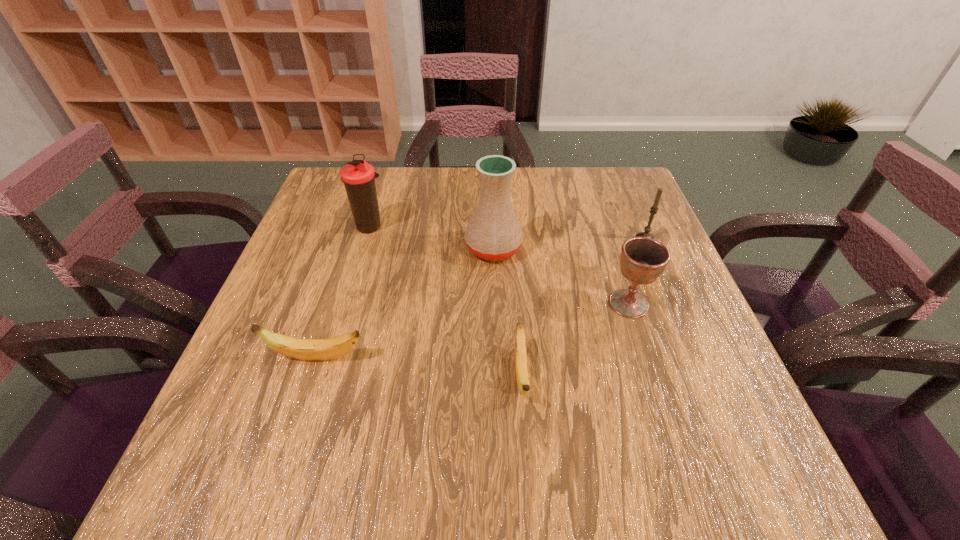
What are the coordinates of `free space between the fifth object from left to right and the pottery` in the screenshot? It's located at (561, 276).

Identify which object is located as the fifth nearest to the candle. Please provide its 2D coordinates. Your answer should be formatted as a tuple, i.e. [(x, y)], where the tuple contains the x and y coordinates of a point satisfying the conditions above.

[(304, 349)]

Identify the location of object that ranks as the third closest to the pottery. (522, 376).

At what (x,y) coordinates should I click in order to perform the action: click on free location that satisfies the following two spatial constraints: 1. on the front side of the pottery; 2. at the stem of the taller banana. Please return your answer as a coordinate pair (x, y). Looking at the image, I should click on (497, 357).